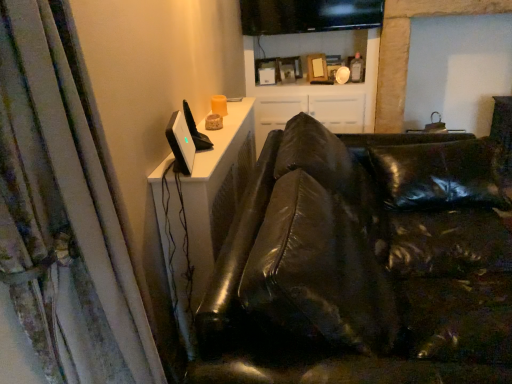
What is the approximate width of satin black monitor at upper left, the first computer monitor when ordered from left to right?

satin black monitor at upper left, the first computer monitor when ordered from left to right, is 2.62 inches in width.

What do you see at coordinates (62, 218) in the screenshot?
I see `white textured curtain at left` at bounding box center [62, 218].

Identify the location of black glossy monitor at upper center, the first computer monitor positioned from the right. (308, 16).

Image resolution: width=512 pixels, height=384 pixels. In order to click on satin black monitor at upper left, the first computer monitor when ordered from left to right in this screenshot , I will do `click(181, 142)`.

Is white textured curtain at left positioned with its back to satin black monitor at upper left, positioned as the 1th computer monitor in front-to-back order?

No, white textured curtain at left is not facing the opposite direction of satin black monitor at upper left, positioned as the 1th computer monitor in front-to-back order.

Is point (52, 173) closer or farther from the camera than point (186, 134)?

Point (52, 173) appears to be closer to the viewer than point (186, 134).

Is white textured curtain at left located outside satin black monitor at upper left, arranged as the 1th computer monitor when ordered from the bottom?

white textured curtain at left lies outside satin black monitor at upper left, arranged as the 1th computer monitor when ordered from the bottom,'s area.

Is black glossy monitor at upper center, which is the first computer monitor from top to bottom, further to the viewer compared to white textured curtain at left?

Yes, the depth of black glossy monitor at upper center, which is the first computer monitor from top to bottom, is greater than that of white textured curtain at left.

Is black glossy monitor at upper center, which is the first computer monitor from back to front, not within white textured curtain at left?

Absolutely, black glossy monitor at upper center, which is the first computer monitor from back to front, is external to white textured curtain at left.

Considering the sizes of objects black glossy monitor at upper center, which is counted as the 2th computer monitor, starting from the bottom, and white textured curtain at left in the image provided, who is wider, black glossy monitor at upper center, which is counted as the 2th computer monitor, starting from the bottom, or white textured curtain at left?

white textured curtain at left is wider.

You are a GUI agent. You are given a task and a screenshot of the screen. Output one action in this format:
    pyautogui.click(x=<x>, y=<y>)
    Task: Click on the curtain directly beneath the black glossy monitor at upper center, which is counted as the 2th computer monitor, starting from the bottom (from a real-world perspective)
    The height and width of the screenshot is (384, 512).
    Given the screenshot: What is the action you would take?
    pyautogui.click(x=62, y=218)

Is black leather couch at center at the right side of white glossy cabinet at upper center?

Indeed, black leather couch at center is positioned on the right side of white glossy cabinet at upper center.

Is black leather couch at center facing towards white glossy cabinet at upper center?

No, black leather couch at center is not turned towards white glossy cabinet at upper center.

This screenshot has height=384, width=512. What are the coordinates of `studio couch that appears below the white glossy cabinet at upper center (from the image's perspective)` in the screenshot? It's located at (362, 265).

Consider the image. Is there a large distance between satin black monitor at upper left, positioned as the 1th computer monitor in front-to-back order, and black glossy monitor at upper center, which is counted as the 2th computer monitor, starting from the bottom?

Yes, satin black monitor at upper left, positioned as the 1th computer monitor in front-to-back order, is far from black glossy monitor at upper center, which is counted as the 2th computer monitor, starting from the bottom.

Does satin black monitor at upper left, the 2th computer monitor when ordered from top to bottom, have a lesser height compared to black glossy monitor at upper center, the first computer monitor positioned from the right?

Correct, satin black monitor at upper left, the 2th computer monitor when ordered from top to bottom, is not as tall as black glossy monitor at upper center, the first computer monitor positioned from the right.

In the image, there is a satin black monitor at upper left, the second computer monitor when ordered from back to front. What are the coordinates of `computer monitor above it (from the image's perspective)` in the screenshot? It's located at (308, 16).

From the image's perspective, which is below, white glossy cabinet at upper center or black glossy monitor at upper center, the first computer monitor positioned from the right?

white glossy cabinet at upper center.

Does white glossy cabinet at upper center contain black glossy monitor at upper center, the second computer monitor positioned from the front?

No, black glossy monitor at upper center, the second computer monitor positioned from the front, is not inside white glossy cabinet at upper center.

Can you confirm if white glossy cabinet at upper center is positioned to the left of black glossy monitor at upper center, the first computer monitor positioned from the right?

Incorrect, white glossy cabinet at upper center is not on the left side of black glossy monitor at upper center, the first computer monitor positioned from the right.

Is point (373, 21) more distant than point (291, 133)?

Yes, it is.

Consider the image. Is white glossy cabinet at upper center far from black leather couch at center?

Yes.

Is white glossy cabinet at upper center wider or thinner than black leather couch at center?

Clearly, white glossy cabinet at upper center has less width compared to black leather couch at center.

Based on the photo, in terms of height, does black leather couch at center look taller or shorter compared to satin black monitor at upper left, the 2th computer monitor when ordered from top to bottom?

Considering their sizes, black leather couch at center has more height than satin black monitor at upper left, the 2th computer monitor when ordered from top to bottom.

In the image, is black leather couch at center positioned in front of or behind satin black monitor at upper left, positioned as the second computer monitor in right-to-left order?

Visually, black leather couch at center is located in front of satin black monitor at upper left, positioned as the second computer monitor in right-to-left order.

Which is more to the left, black leather couch at center or satin black monitor at upper left, the 2th computer monitor when ordered from top to bottom?

From the viewer's perspective, satin black monitor at upper left, the 2th computer monitor when ordered from top to bottom, appears more on the left side.

Is satin black monitor at upper left, the second computer monitor when ordered from back to front, at the back of black leather couch at center?

black leather couch at center is not turned away from satin black monitor at upper left, the second computer monitor when ordered from back to front.

Locate an element on the screen. curtain below the satin black monitor at upper left, arranged as the 1th computer monitor when ordered from the bottom (from the image's perspective) is located at coordinates (62, 218).

Where is `computer monitor that is the 2nd one when counting backward from the white textured curtain at left`? The image size is (512, 384). computer monitor that is the 2nd one when counting backward from the white textured curtain at left is located at coordinates (308, 16).

When comparing their distances from satin black monitor at upper left, the first computer monitor when ordered from left to right, does black glossy monitor at upper center, the first computer monitor positioned from the right, or white textured curtain at left seem further?

black glossy monitor at upper center, the first computer monitor positioned from the right, is further to satin black monitor at upper left, the first computer monitor when ordered from left to right.

Looking at the image, which one is located closer to white glossy cabinet at upper center, black leather couch at center or white textured curtain at left?

black leather couch at center.

From the image, which object appears to be nearer to white textured curtain at left, black leather couch at center or satin black monitor at upper left, positioned as the 1th computer monitor in front-to-back order?

satin black monitor at upper left, positioned as the 1th computer monitor in front-to-back order.

From the picture: Which object lies further to the anchor point white textured curtain at left, satin black monitor at upper left, the second computer monitor when ordered from back to front, or white glossy cabinet at upper center?

Based on the image, white glossy cabinet at upper center appears to be further to white textured curtain at left.

Based on their spatial positions, is white glossy cabinet at upper center or white textured curtain at left further from black glossy monitor at upper center, which is the first computer monitor from top to bottom?

white textured curtain at left.

From the image, which object appears to be nearer to white textured curtain at left, satin black monitor at upper left, arranged as the 1th computer monitor when ordered from the bottom, or black leather couch at center?

satin black monitor at upper left, arranged as the 1th computer monitor when ordered from the bottom.

Considering their positions, is white textured curtain at left positioned further to satin black monitor at upper left, the first computer monitor when ordered from left to right, than white glossy cabinet at upper center?

white glossy cabinet at upper center is positioned further to the anchor satin black monitor at upper left, the first computer monitor when ordered from left to right.

Based on their spatial positions, is white textured curtain at left or black glossy monitor at upper center, which is counted as the 2th computer monitor, starting from the bottom, further from satin black monitor at upper left, positioned as the 1th computer monitor in front-to-back order?

Based on the image, black glossy monitor at upper center, which is counted as the 2th computer monitor, starting from the bottom, appears to be further to satin black monitor at upper left, positioned as the 1th computer monitor in front-to-back order.

I want to click on studio couch between white textured curtain at left and black glossy monitor at upper center, the second computer monitor positioned from the front, from front to back, so click(362, 265).

Identify the location of computer monitor between black leather couch at center and black glossy monitor at upper center, which is counted as the 2th computer monitor, starting from the bottom, along the z-axis. (181, 142).

Identify the location of computer monitor between satin black monitor at upper left, positioned as the second computer monitor in right-to-left order, and white glossy cabinet at upper center in the front-back direction. This screenshot has width=512, height=384. click(308, 16).

Image resolution: width=512 pixels, height=384 pixels. I want to click on computer monitor positioned between white textured curtain at left and black glossy monitor at upper center, which is the first computer monitor from top to bottom, from near to far, so click(x=181, y=142).